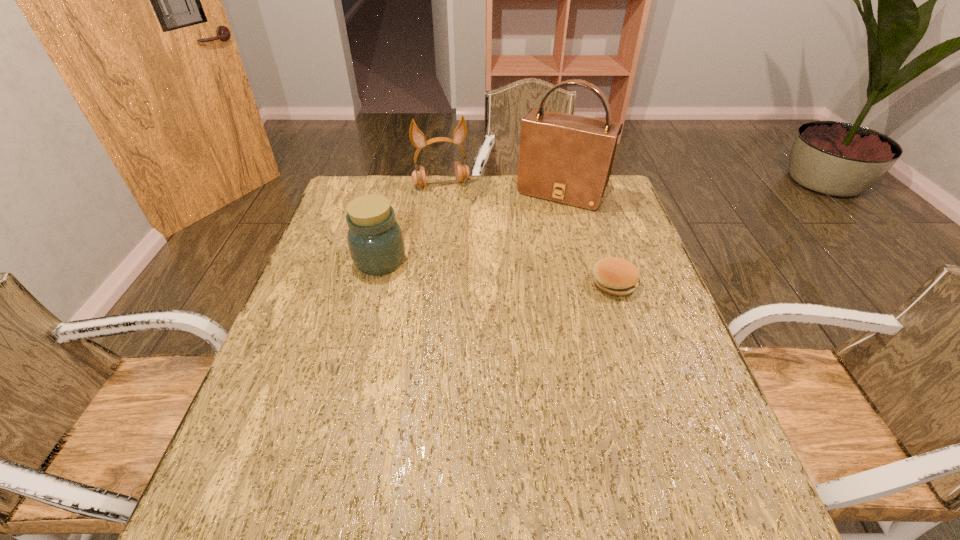
At what (x,y) coordinates should I click in order to perform the action: click on vacant space at the right edge of the desktop. Please return your answer as a coordinate pair (x, y). Looking at the image, I should click on (626, 231).

Find the location of `vacant space at the far right corner`. vacant space at the far right corner is located at coordinates (613, 192).

The height and width of the screenshot is (540, 960). Identify the location of unoccupied position between the third tallest object and the shortest object. (497, 272).

This screenshot has width=960, height=540. What are the coordinates of `free space that is in between the second tallest object and the patty` in the screenshot? It's located at (528, 234).

Where is `vacant area that lies between the jar and the tallest object`? The height and width of the screenshot is (540, 960). vacant area that lies between the jar and the tallest object is located at coordinates (470, 227).

Locate an element on the screen. This screenshot has width=960, height=540. free space between the shortest object and the tallest object is located at coordinates [x=588, y=238].

Where is `vacant space that's between the second tallest object and the patty`? The width and height of the screenshot is (960, 540). vacant space that's between the second tallest object and the patty is located at coordinates (528, 234).

You are a GUI agent. You are given a task and a screenshot of the screen. Output one action in this format:
    pyautogui.click(x=<x>, y=<y>)
    Task: Click on the free point between the third tallest object and the tallest object
    
    Given the screenshot: What is the action you would take?
    pyautogui.click(x=470, y=227)

Identify the location of free point between the third tallest object and the shortest object. The width and height of the screenshot is (960, 540). (497, 272).

What are the coordinates of `free space between the tallest object and the third tallest object` in the screenshot? It's located at (470, 227).